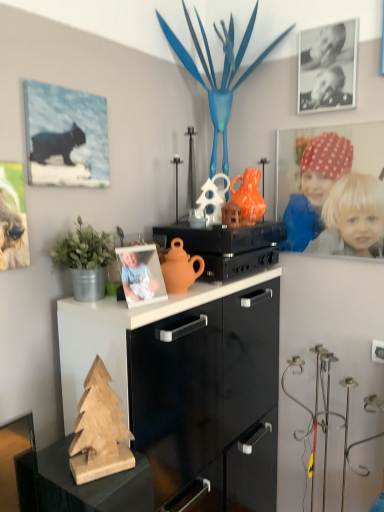
Image resolution: width=384 pixels, height=512 pixels. Identify the location of free location to the left of wooden christmas tree at lower left. (54, 468).